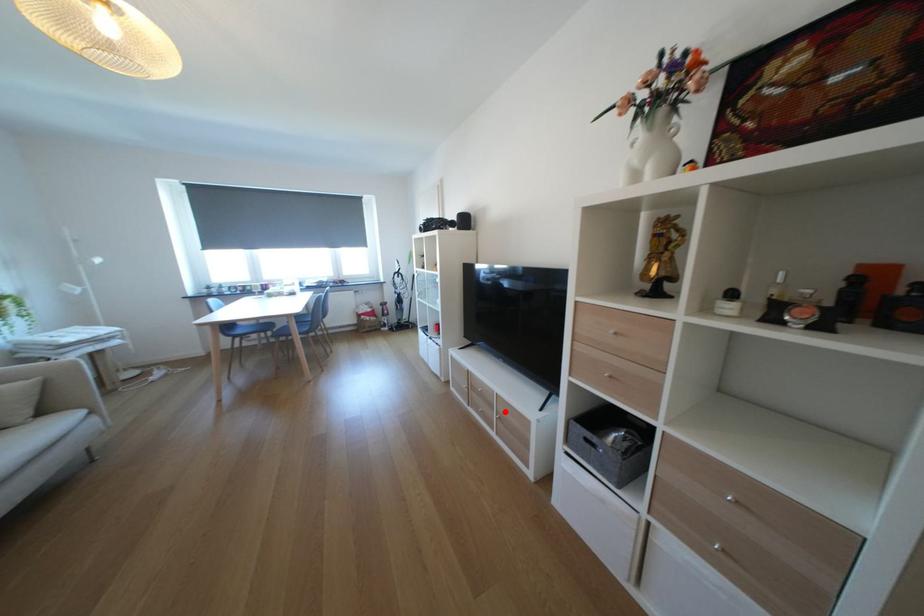
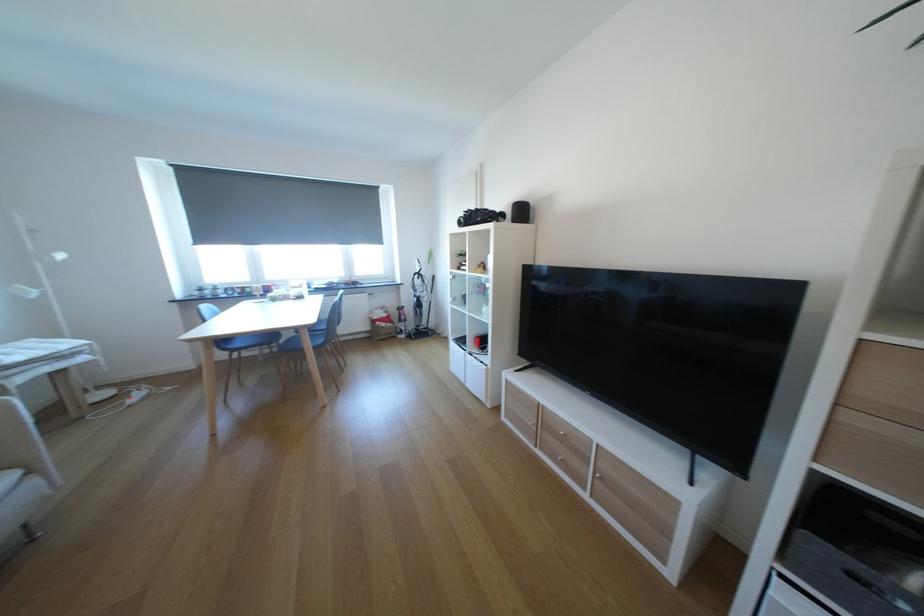
Question: I am providing you with two images of the same scene from different viewpoints. Given a red point in image1, look at the same physical point in image2. Is it:

Choices:
 (A) Closer to the viewpoint
 (B) Farther from the viewpoint

Answer: (A)